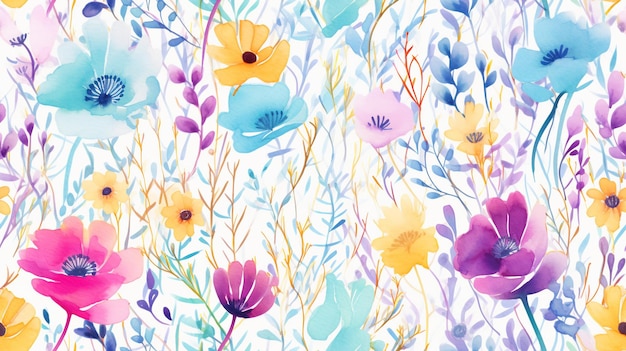
Identify the location of flower on the bottom right corner. (618, 314).